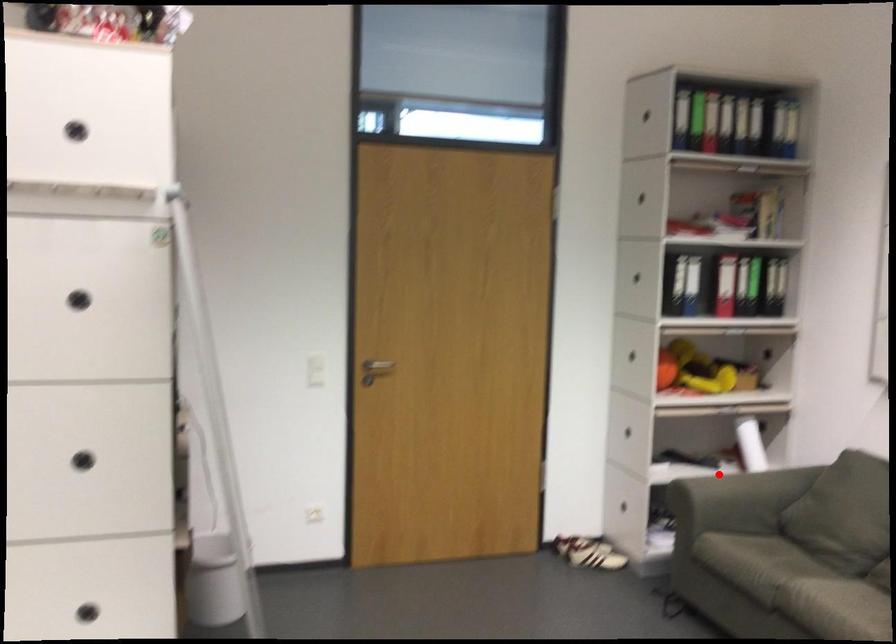
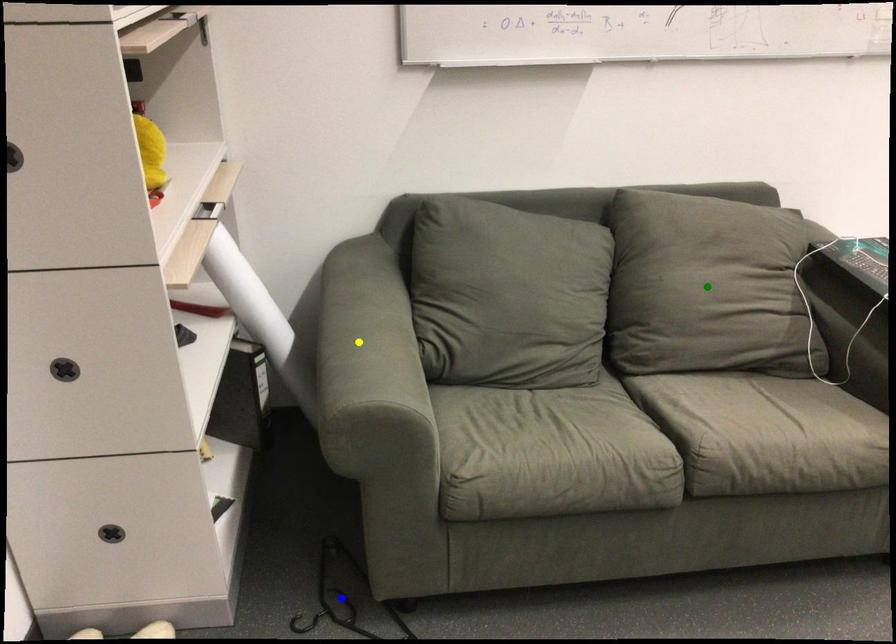
Question: I am providing you with two images of the same scene from different viewpoints. A red point is marked on the first image. You are given multiple points on the second image. Can you choose the point in image 2 that corresponds to the point in image 1?

Choices:
 (A) blue point
 (B) green point
 (C) yellow point

Answer: (C)